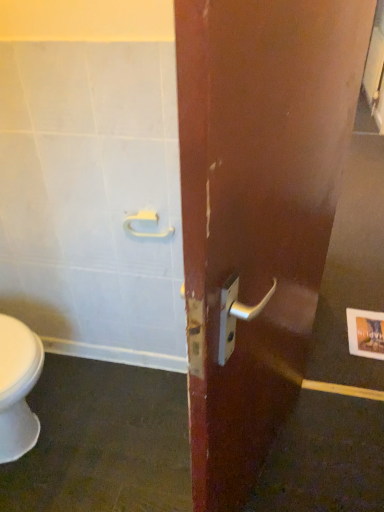
What is the approximate width of matte brown door at center?

The width of matte brown door at center is 11.99 centimeters.

Where is `matte brown door at center`? The image size is (384, 512). matte brown door at center is located at coordinates (257, 211).

Describe the element at coordinates (257, 211) in the screenshot. I see `matte brown door at center` at that location.

Find the location of a particular element. The height and width of the screenshot is (512, 384). matte brown door at center is located at coordinates (257, 211).